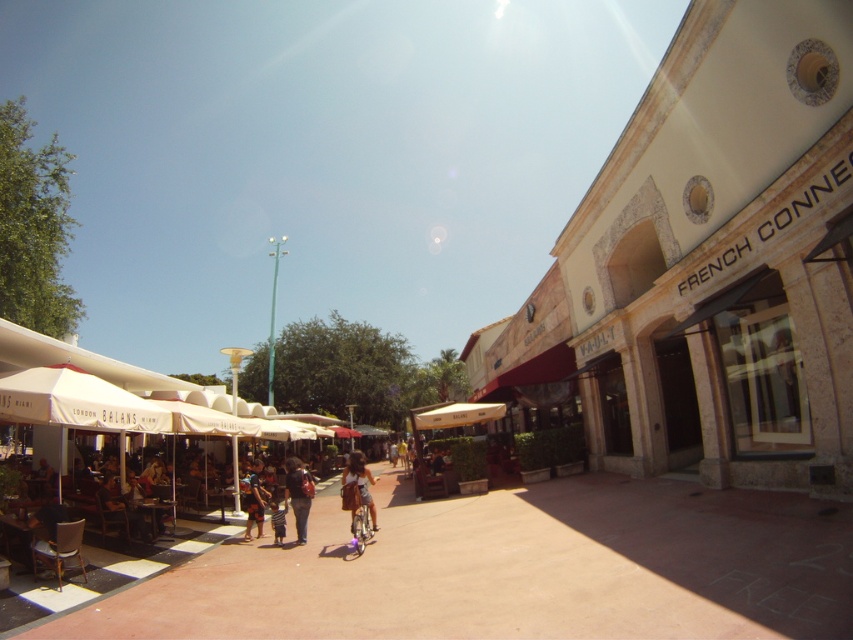
Between white fabric canopy at center and matte black backpack at center, which one appears on the right side from the viewer's perspective?

Positioned to the right is white fabric canopy at center.

Is point (483, 410) behind point (297, 528)?

Yes, point (483, 410) is behind point (297, 528).

Which is in front, point (459, 420) or point (299, 516)?

Point (299, 516) is in front.

You are a GUI agent. You are given a task and a screenshot of the screen. Output one action in this format:
    pyautogui.click(x=<x>, y=<y>)
    Task: Click on the white fabric canopy at center
    This screenshot has width=853, height=640.
    Given the screenshot: What is the action you would take?
    pyautogui.click(x=456, y=413)

Is point (457, 419) in front of point (260, 512)?

No.

Can you confirm if white fabric canopy at center is positioned to the right of blue denim shorts at center?

Indeed, white fabric canopy at center is positioned on the right side of blue denim shorts at center.

At what (x,y) coordinates should I click in order to perform the action: click on white fabric canopy at center. Please return your answer as a coordinate pair (x, y). Looking at the image, I should click on (456, 413).

What do you see at coordinates (357, 486) in the screenshot?
I see `denim jacket at center` at bounding box center [357, 486].

Is denim jacket at center in front of matte black backpack at center?

Yes, it is in front of matte black backpack at center.

Who is more forward, (x=347, y=506) or (x=291, y=502)?

Point (x=347, y=506) is in front.

At what (x,y) coordinates should I click in order to perform the action: click on denim jacket at center. Please return your answer as a coordinate pair (x, y). This screenshot has height=640, width=853. Looking at the image, I should click on (357, 486).